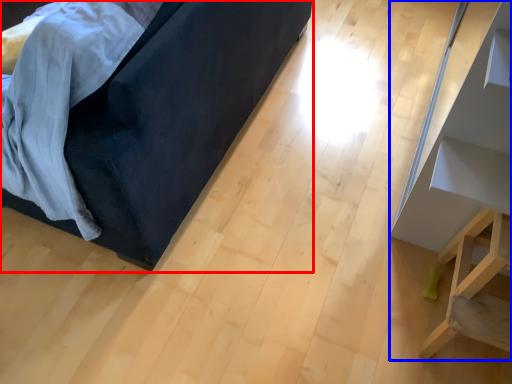
Question: Which of the following is the farthest to the observer, furniture (highlighted by a red box) or furniture (highlighted by a blue box)?

Choices:
 (A) furniture
 (B) furniture

Answer: (B)